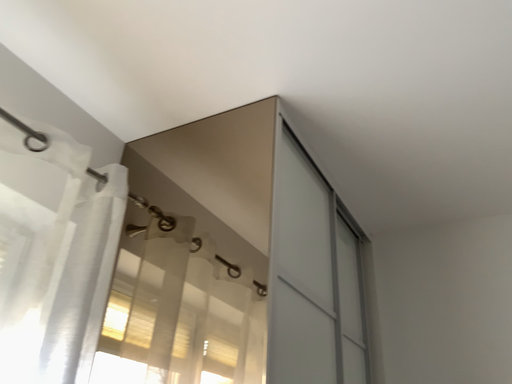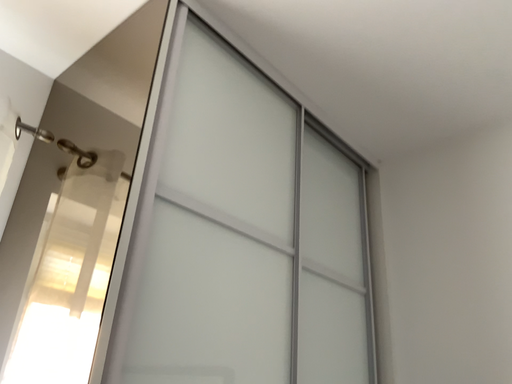
Question: How did the camera likely rotate when shooting the video?

Choices:
 (A) rotated right
 (B) rotated left

Answer: (B)